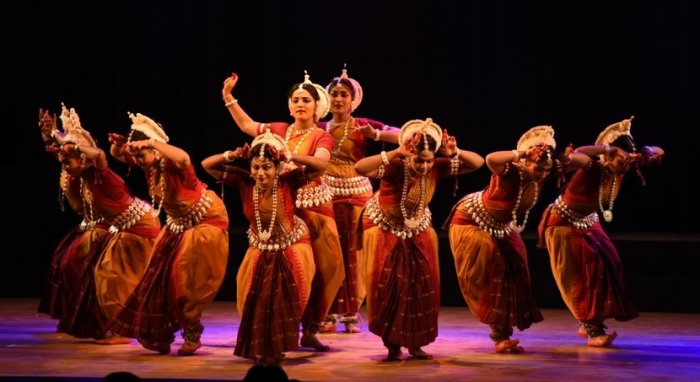
Identify the location of stage. The width and height of the screenshot is (700, 382). (344, 348).